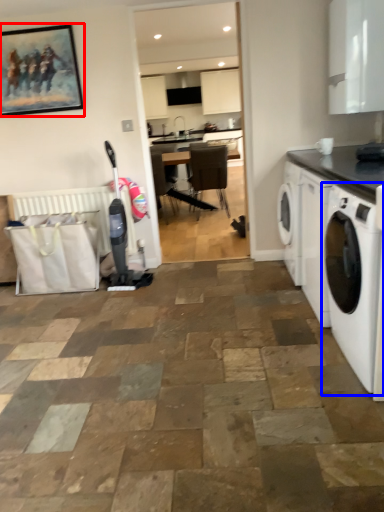
Question: Which of the following is the closest to the observer, picture frame (highlighted by a red box) or washing machine (highlighted by a blue box)?

Choices:
 (A) picture frame
 (B) washing machine

Answer: (B)